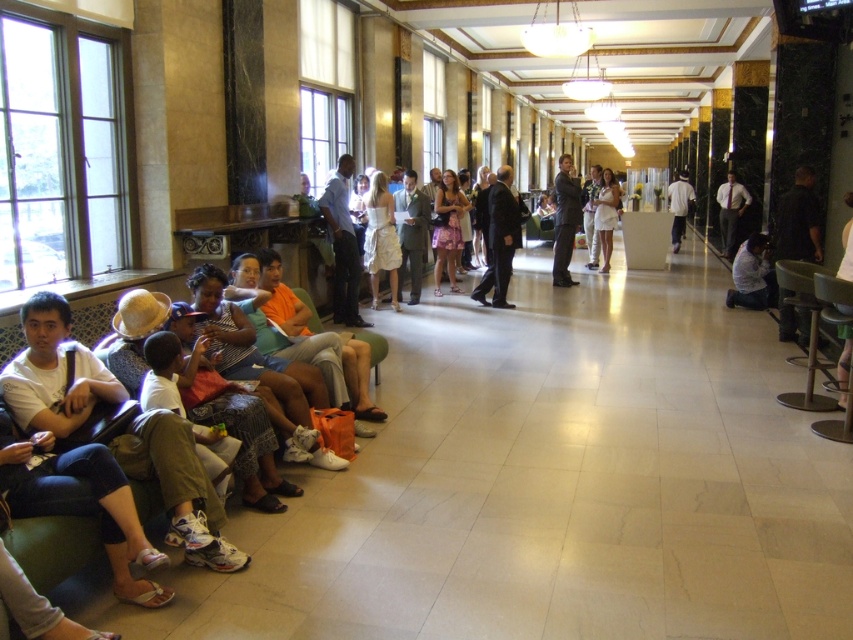
Question: Which point is closer to the camera?

Choices:
 (A) (744, 280)
 (B) (744, 196)
 (C) (326, 216)
 (D) (811, 205)

Answer: (D)

Question: Can you confirm if white cotton shirt at center is positioned below white matte shirt at center?

Choices:
 (A) no
 (B) yes

Answer: (B)

Question: Estimate the real-world distances between objects in this image. Which object is farther from the white dress at center?

Choices:
 (A) white cotton shirt at center
 (B) light blue shirt at center

Answer: (A)

Question: Which point is closer to the camera?

Choices:
 (A) (730, 177)
 (B) (759, 234)
 (C) (614, 218)
 (D) (798, 216)

Answer: (D)

Question: Does dark gray suit at center come behind white dress at center?

Choices:
 (A) no
 (B) yes

Answer: (A)

Question: Is black matte shirt at right behind light blue shirt at center?

Choices:
 (A) no
 (B) yes

Answer: (A)